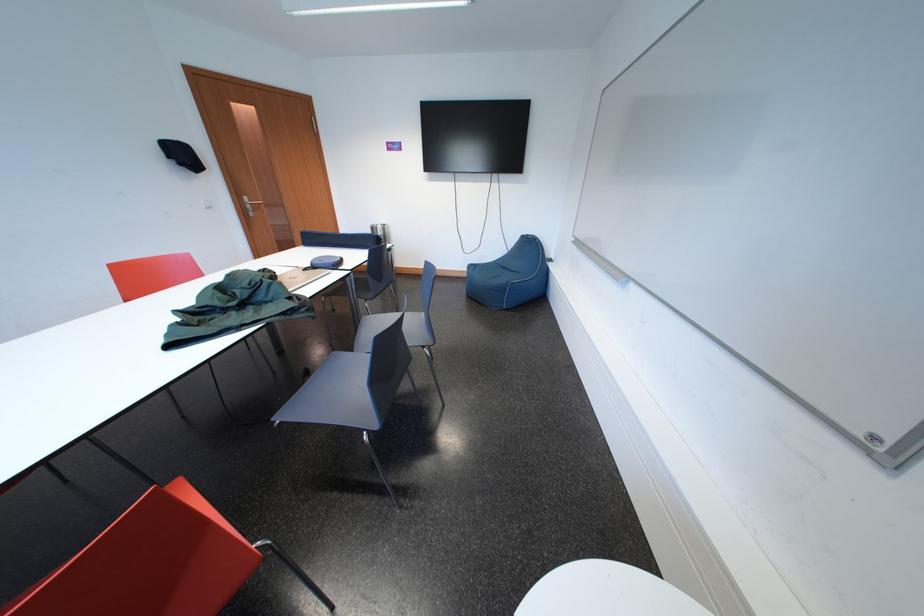
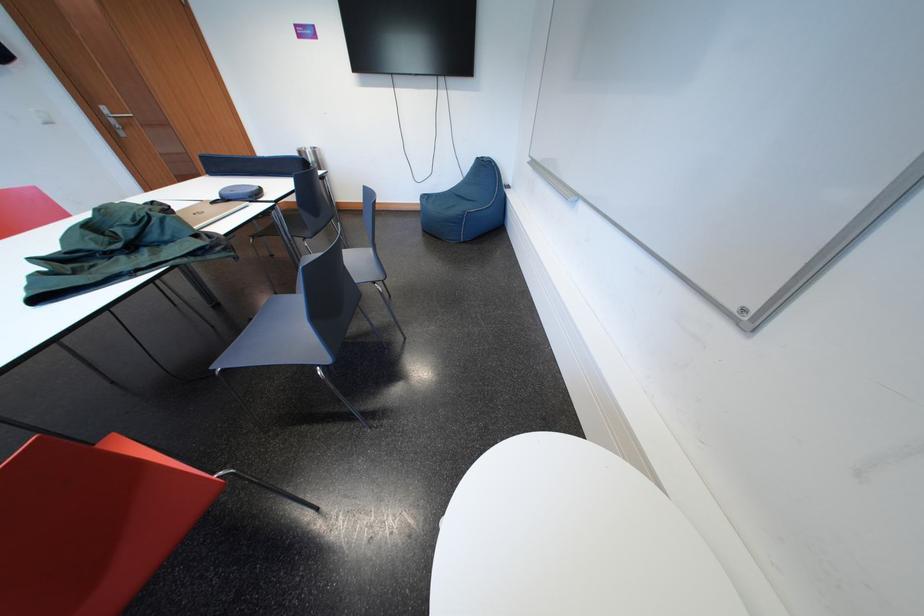
Where in the second image is the point corresponding to the point at 323,272 from the first image?

(235, 204)